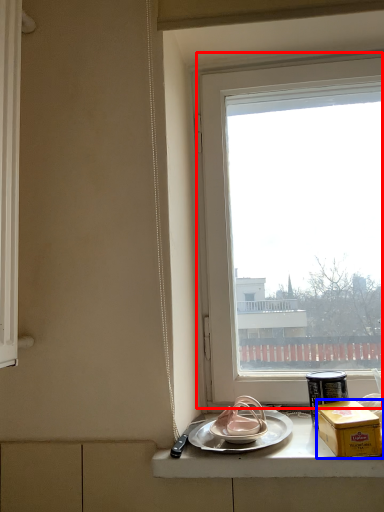
Question: Which of the following is the closest to the observer, window (highlighted by a red box) or box (highlighted by a blue box)?

Choices:
 (A) window
 (B) box

Answer: (B)